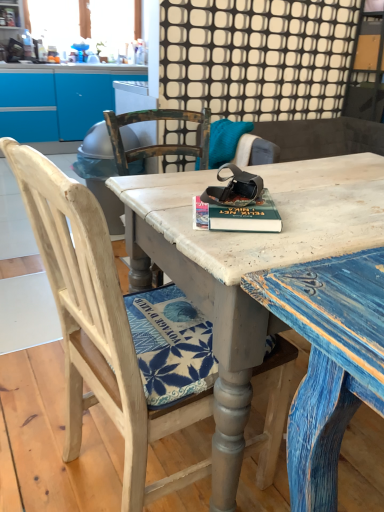
The height and width of the screenshot is (512, 384). What are the coordinates of `distressed wood desk at center` in the screenshot? It's located at [x=248, y=264].

Find the location of a particular element. distressed wood desk at center is located at coordinates (248, 264).

Between wooden chair at center and hardcover book at center, which one has more height?

With more height is wooden chair at center.

Between wooden chair at center and hardcover book at center, which one has smaller width?

hardcover book at center.

Considering the points (37, 218) and (199, 199), which point is in front, point (37, 218) or point (199, 199)?

The point (37, 218) is more forward.

In terms of width, does hardcover book at center look wider or thinner when compared to distressed wood desk at center?

Considering their sizes, hardcover book at center looks slimmer than distressed wood desk at center.

Is distressed wood desk at center located within hardcover book at center?

That's incorrect, distressed wood desk at center is not inside hardcover book at center.

The width and height of the screenshot is (384, 512). Find the location of `desk below the hardcover book at center (from the image's perspective)`. desk below the hardcover book at center (from the image's perspective) is located at coordinates (248, 264).

From a real-world perspective, is hardcover book at center located higher than distressed wood desk at center?

Indeed, from a real-world perspective, hardcover book at center stands above distressed wood desk at center.

From the image's perspective, is hardcover book at center under wooden chair at center?

No, from the image's perspective, hardcover book at center is not beneath wooden chair at center.

Is wooden chair at center a part of hardcover book at center?

No.

Who is smaller, hardcover book at center or wooden chair at center?

hardcover book at center.

Is point (265, 225) closer to viewer compared to point (137, 431)?

Yes, point (265, 225) is in front of point (137, 431).

Which is closer, (150, 245) or (287, 349)?

Point (287, 349)

Can you confirm if distressed wood desk at center is bigger than wooden chair at center?

Yes, distressed wood desk at center is bigger than wooden chair at center.

From the image's perspective, which one is positioned lower, distressed wood desk at center or wooden chair at center?

From the image's view, wooden chair at center is below.

Which is more to the left, distressed wood desk at center or wooden chair at center?

From the viewer's perspective, wooden chair at center appears more on the left side.

What's the angular difference between distressed wood desk at center and hardcover book at center's facing directions?

distressed wood desk at center and hardcover book at center are facing 61 degrees away from each other.

Visually, is distressed wood desk at center positioned to the left or to the right of hardcover book at center?

In the image, distressed wood desk at center appears on the right side of hardcover book at center.

Do you think distressed wood desk at center is within hardcover book at center, or outside of it?

distressed wood desk at center is outside hardcover book at center.

Between point (307, 250) and point (227, 229), which one is positioned behind?

Positioned behind is point (227, 229).

Does wooden chair at center turn towards distressed wood desk at center?

Yes, wooden chair at center is aimed at distressed wood desk at center.

Considering the relative sizes of wooden chair at center and distressed wood desk at center in the image provided, is wooden chair at center bigger than distressed wood desk at center?

No.

Does point (52, 255) come behind point (304, 172)?

No, it is in front of (304, 172).

Considering the relative positions of wooden chair at center and distressed wood desk at center in the image provided, is wooden chair at center to the right of distressed wood desk at center from the viewer's perspective?

In fact, wooden chair at center is to the left of distressed wood desk at center.

Locate an element on the screen. This screenshot has width=384, height=512. chair that is on the left side of hardcover book at center is located at coordinates coord(98,326).

Locate an element on the screen. This screenshot has width=384, height=512. desk on the right of hardcover book at center is located at coordinates (248, 264).

In the scene shown: From the image, which object appears to be farther from distressed wood desk at center, hardcover book at center or wooden chair at center?

wooden chair at center.

Which object lies nearer to the anchor point wooden chair at center, hardcover book at center or distressed wood desk at center?

The object closer to wooden chair at center is distressed wood desk at center.

Based on their spatial positions, is wooden chair at center or distressed wood desk at center closer to hardcover book at center?

distressed wood desk at center is positioned closer to the anchor hardcover book at center.

From the image, which object appears to be nearer to hardcover book at center, distressed wood desk at center or wooden chair at center?

distressed wood desk at center is positioned closer to the anchor hardcover book at center.

Considering their positions, is wooden chair at center positioned closer to distressed wood desk at center than hardcover book at center?

hardcover book at center is positioned closer to the anchor distressed wood desk at center.

Based on the photo, based on their spatial positions, is distressed wood desk at center or hardcover book at center further from wooden chair at center?

Among the two, hardcover book at center is located further to wooden chair at center.

Where is `paperback book between wooden chair at center and distressed wood desk at center from left to right`? paperback book between wooden chair at center and distressed wood desk at center from left to right is located at coordinates (237, 215).